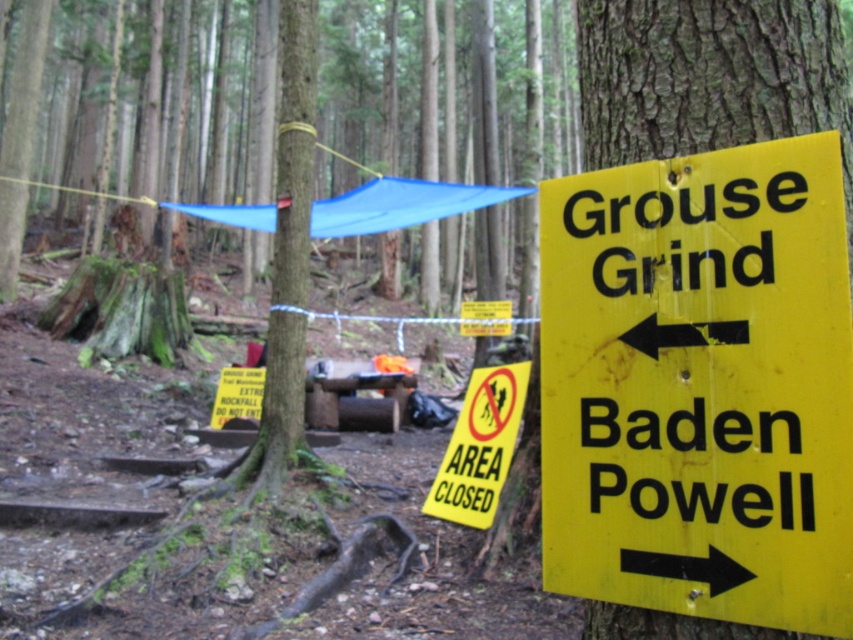
You are standing at the forest trail and see two points marked in the image. Which point, point (602, 337) or point (502, 432), is closer to you?

Point (602, 337) is closer to the viewer than point (502, 432).

You are a hiker who needs to decide between two signs to follow. The yellow matte sign at right points left towards Grouse Grind, while the yellow paper sign at center points right towards Baden Powell. Which sign has a wider physical size?

The yellow paper sign at center has a larger width than the yellow matte sign at right, so it is wider in physical size.